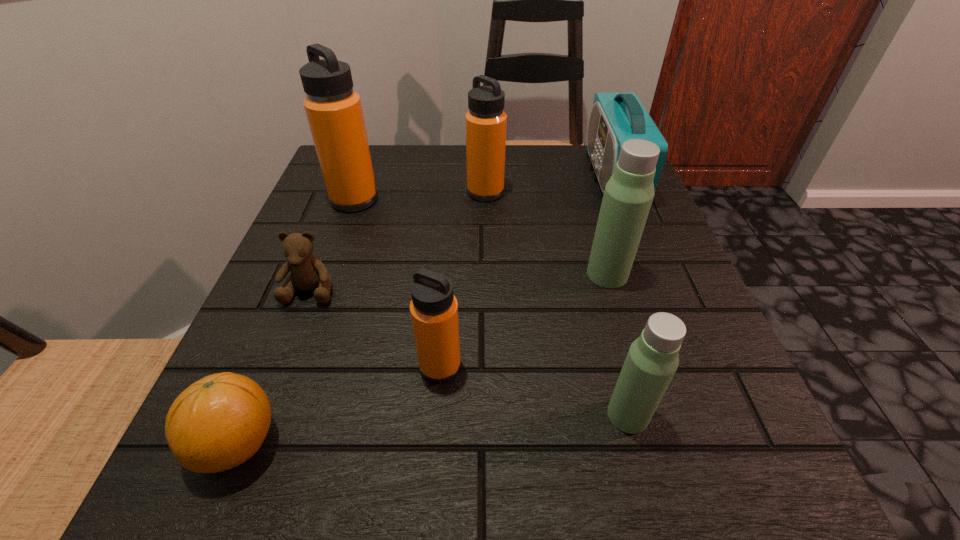
Find the location of a particular element. The width and height of the screenshot is (960, 540). the fourth farthest thermos bottle is located at coordinates [434, 309].

The image size is (960, 540). Find the location of `teddy bear`. teddy bear is located at coordinates (308, 273).

Find the location of a particular element. orange is located at coordinates (219, 422).

Image resolution: width=960 pixels, height=540 pixels. I want to click on free space located on the front panel of the light radio receiver, so click(511, 176).

Locate an element on the screen. This screenshot has width=960, height=540. vacant space located on the front panel of the light radio receiver is located at coordinates (519, 176).

Locate an element on the screen. vacant area situated 0.120m on the front panel of the light radio receiver is located at coordinates (537, 176).

Where is `free space located 0.170m on the front of the seventh shortest object`? Image resolution: width=960 pixels, height=540 pixels. free space located 0.170m on the front of the seventh shortest object is located at coordinates (329, 272).

At what (x,y) coordinates should I click in order to perform the action: click on free spot located 0.050m on the back of the second smallest orange thermos bottle. Please return your answer as a coordinate pair (x, y). Looking at the image, I should click on (485, 171).

In order to click on vacant area situated on the left of the farther light thermos bottle in this screenshot , I will do `click(523, 274)`.

The width and height of the screenshot is (960, 540). I want to click on vacant region located on the right of the nearer light thermos bottle, so pos(686,415).